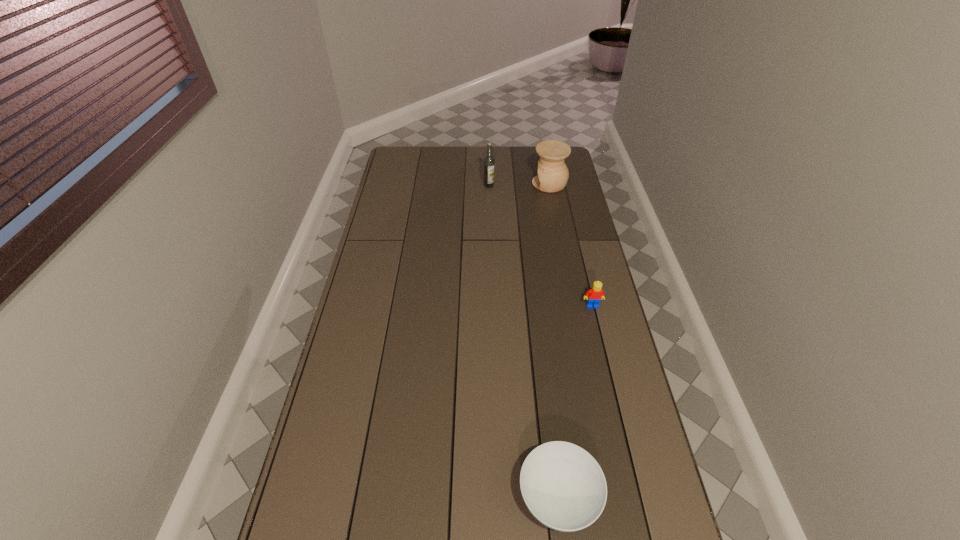
Choose which object is the second nearest neighbor to the nearest object. Please provide its 2D coordinates. Your answer should be formatted as a tuple, i.e. [(x, y)], where the tuple contains the x and y coordinates of a point satisfying the conditions above.

[(553, 174)]

Locate an element on the screen. free point that satisfies the following two spatial constraints: 1. at the open side of the third shortest object; 2. on the label of the tallest object is located at coordinates (550, 186).